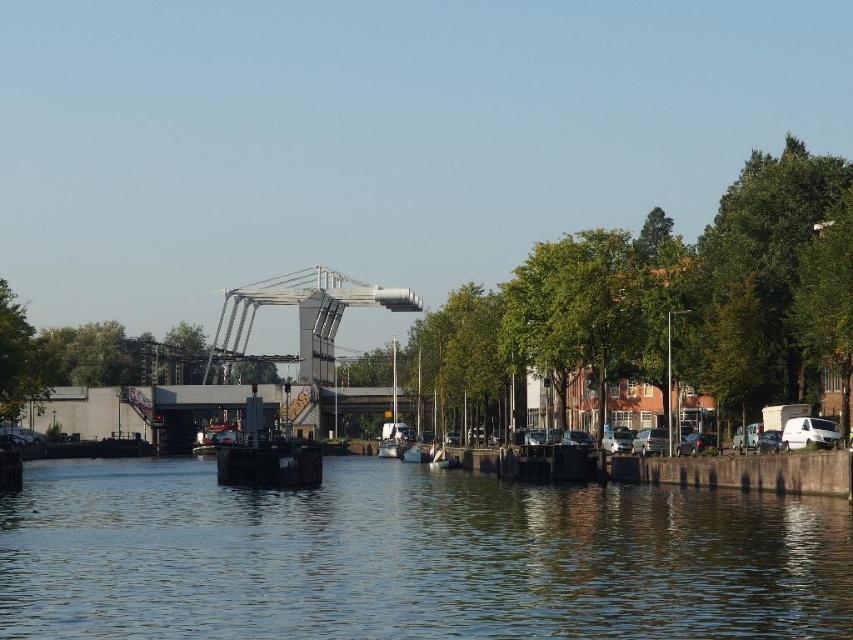
You are standing on the embankment near the parked cars on the right side of the canal. You want to walk straight towards the green leafy tree at center. How far will you have to walk to reach it?

The green leafy tree at center is 110.09 meters away from the viewer, so you will have to walk 110.09 meters to reach it.

You are standing on the drawbridge and want to look at two points in the scene. The first point is point (332, 481) and the second point is point (26, 376). Which point is closer to you?

Point (332, 481) is closer to the viewer than point (26, 376).